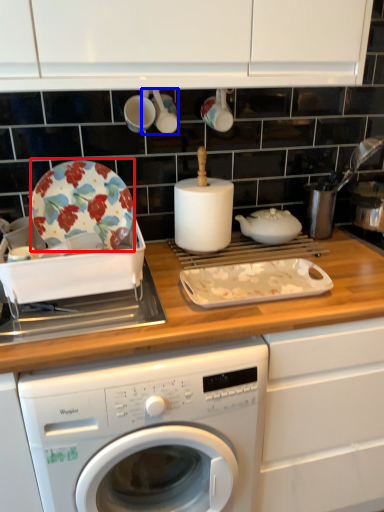
Question: Which of the following is the closest to the observer, plate (highlighted by a red box) or tableware (highlighted by a blue box)?

Choices:
 (A) plate
 (B) tableware

Answer: (A)